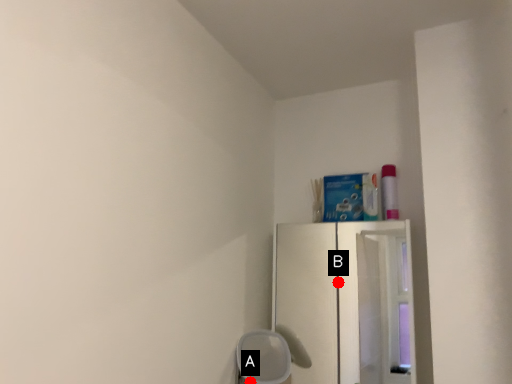
Question: Two points are circled on the image, labeled by A and B beside each circle. Which point appears farthest from the camera in this image?

Choices:
 (A) A is further
 (B) B is further

Answer: (B)